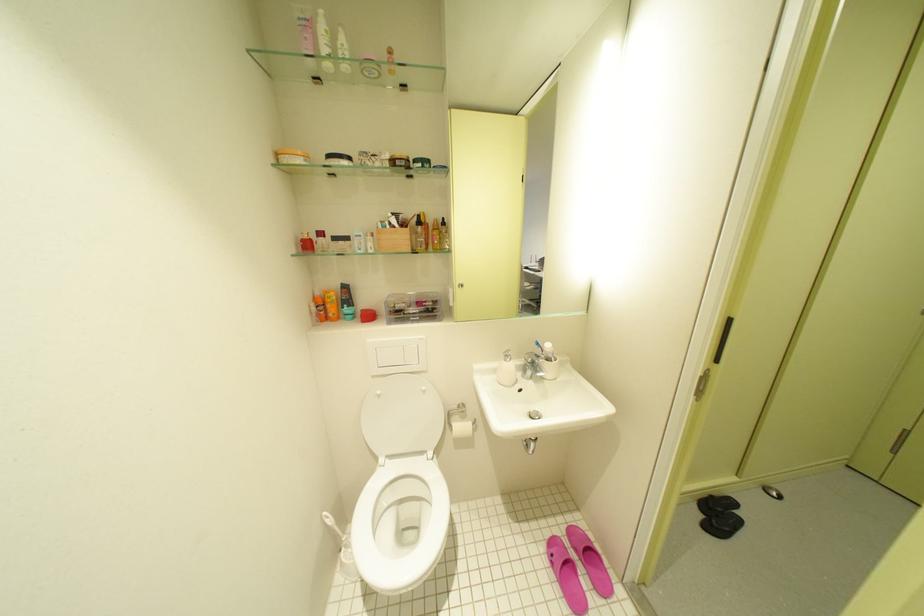
Locate an element on the screen. The height and width of the screenshot is (616, 924). black cosmetic tube is located at coordinates (346, 296).